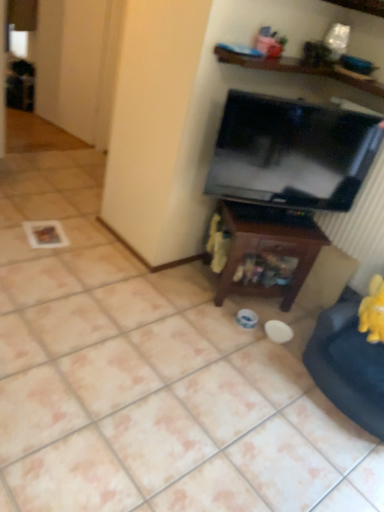
The width and height of the screenshot is (384, 512). What do you see at coordinates (298, 69) in the screenshot?
I see `wooden at upper center` at bounding box center [298, 69].

The width and height of the screenshot is (384, 512). Identify the location of brown wood table at center. (267, 246).

How distant is wooden at upper center from brown wood table at center?

wooden at upper center and brown wood table at center are 33.33 inches apart from each other.

Is wooden at upper center positioned far away from brown wood table at center?

No.

Which is correct: wooden at upper center is inside brown wood table at center, or outside of it?

wooden at upper center is outside brown wood table at center.

Visually, is wooden at upper center positioned to the left or to the right of brown wood table at center?

From the image, it's evident that wooden at upper center is to the right of brown wood table at center.

Is black glossy tv at upper right wider or thinner than velvet yellow swivel chair at lower right?

In the image, black glossy tv at upper right appears to be more narrow than velvet yellow swivel chair at lower right.

From the image's perspective, between black glossy tv at upper right and velvet yellow swivel chair at lower right, which one is located above?

black glossy tv at upper right appears higher in the image.

Is black glossy tv at upper right oriented away from velvet yellow swivel chair at lower right?

No, black glossy tv at upper right is not facing the opposite direction of velvet yellow swivel chair at lower right.

Is black glossy tv at upper right in front of velvet yellow swivel chair at lower right?

No.

Which of these two, wooden at upper center or black glossy tv at upper right, is bigger?

With larger size is black glossy tv at upper right.

Between wooden at upper center and black glossy tv at upper right, which one appears on the left side from the viewer's perspective?

black glossy tv at upper right.

From the image's perspective, is wooden at upper center under black glossy tv at upper right?

Incorrect, from the image's perspective, wooden at upper center is higher than black glossy tv at upper right.

Is wooden at upper center directly adjacent to black glossy tv at upper right?

No, wooden at upper center is not with black glossy tv at upper right.

Would you say velvet yellow swivel chair at lower right is a long distance from black glossy tv at upper right?

Actually, velvet yellow swivel chair at lower right and black glossy tv at upper right are a little close together.

Considering the sizes of objects velvet yellow swivel chair at lower right and black glossy tv at upper right in the image provided, who is smaller, velvet yellow swivel chair at lower right or black glossy tv at upper right?

black glossy tv at upper right is smaller.

From the image's perspective, would you say velvet yellow swivel chair at lower right is positioned over black glossy tv at upper right?

No.

Between point (342, 334) and point (344, 112), which one is positioned behind?

Point (344, 112)

Is black glossy tv at upper right thinner than wooden at upper center?

Correct, the width of black glossy tv at upper right is less than that of wooden at upper center.

Considering the sizes of objects black glossy tv at upper right and wooden at upper center in the image provided, who is smaller, black glossy tv at upper right or wooden at upper center?

wooden at upper center is smaller.

Does point (306, 168) lie in front of point (357, 85)?

Yes, point (306, 168) is closer to viewer.

Which object is thinner, brown wood table at center or wooden at upper center?

Thinner between the two is brown wood table at center.

How different are the orientations of brown wood table at center and wooden at upper center in degrees?

The angular difference between brown wood table at center and wooden at upper center is 59 degrees.

Would you say brown wood table at center is outside wooden at upper center?

Yes, brown wood table at center is located beyond the bounds of wooden at upper center.

Is brown wood table at center placed right next to wooden at upper center?

brown wood table at center and wooden at upper center are not in contact.

Looking at this image, is black glossy tv at upper right wider or thinner than brown wood table at center?

black glossy tv at upper right is thinner than brown wood table at center.

This screenshot has height=512, width=384. I want to click on television above the brown wood table at center (from a real-world perspective), so click(x=292, y=152).

Between black glossy tv at upper right and brown wood table at center, which one has less height?

With less height is brown wood table at center.

Is point (262, 108) closer to camera compared to point (299, 271)?

Yes.

Locate an element on the screen. table behind the wooden at upper center is located at coordinates (267, 246).

Where is `swivel chair located in front of the black glossy tv at upper right`? swivel chair located in front of the black glossy tv at upper right is located at coordinates (348, 366).

When comparing their distances from brown wood table at center, does black glossy tv at upper right or wooden at upper center seem closer?

black glossy tv at upper right is closer to brown wood table at center.

Looking at the image, which one is located closer to black glossy tv at upper right, brown wood table at center or velvet yellow swivel chair at lower right?

brown wood table at center is positioned closer to the anchor black glossy tv at upper right.

Which object lies further to the anchor point black glossy tv at upper right, brown wood table at center or wooden at upper center?

The object further to black glossy tv at upper right is wooden at upper center.

From the image, which object appears to be nearer to wooden at upper center, brown wood table at center or black glossy tv at upper right?

The object closer to wooden at upper center is black glossy tv at upper right.

Estimate the real-world distances between objects in this image. Which object is closer to black glossy tv at upper right, velvet yellow swivel chair at lower right or wooden at upper center?

The object closer to black glossy tv at upper right is wooden at upper center.

From the image, which object appears to be farther from velvet yellow swivel chair at lower right, wooden at upper center or brown wood table at center?

wooden at upper center lies further to velvet yellow swivel chair at lower right than the other object.

Based on their spatial positions, is brown wood table at center or black glossy tv at upper right further from velvet yellow swivel chair at lower right?

Based on the image, black glossy tv at upper right appears to be further to velvet yellow swivel chair at lower right.

Which object lies nearer to the anchor point black glossy tv at upper right, wooden at upper center or brown wood table at center?

brown wood table at center is closer to black glossy tv at upper right.

Locate an element on the screen. The image size is (384, 512). television that lies between wooden at upper center and brown wood table at center from top to bottom is located at coordinates (292, 152).

Identify the location of table between black glossy tv at upper right and velvet yellow swivel chair at lower right from top to bottom. The image size is (384, 512). (267, 246).

This screenshot has width=384, height=512. I want to click on television between wooden at upper center and velvet yellow swivel chair at lower right from top to bottom, so click(x=292, y=152).

The width and height of the screenshot is (384, 512). I want to click on table that lies between wooden at upper center and velvet yellow swivel chair at lower right from top to bottom, so click(267, 246).